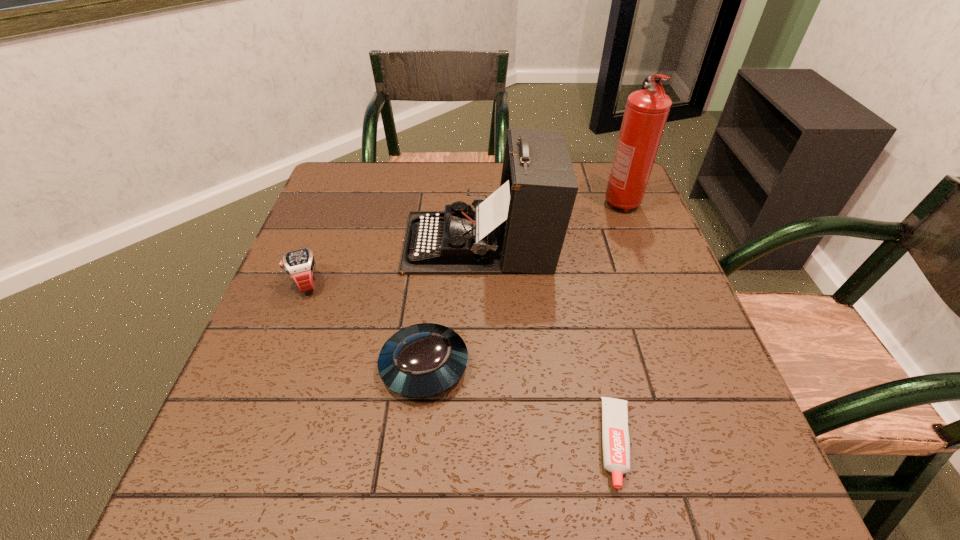
Find the location of a particular element. This screenshot has width=960, height=540. vacant region at the far edge of the desktop is located at coordinates (445, 185).

Where is `free spot at the left edge of the desktop`? This screenshot has height=540, width=960. free spot at the left edge of the desktop is located at coordinates 266,328.

Locate an element on the screen. The image size is (960, 540). vacant space at the right edge of the desktop is located at coordinates (650, 284).

Find the location of `free region at the near left corner of the desktop`. free region at the near left corner of the desktop is located at coordinates (230, 463).

Identify the location of blank space at the far right corner. (602, 177).

Image resolution: width=960 pixels, height=540 pixels. In order to click on free space between the leftmost object and the typewriter in this screenshot , I will do `click(394, 262)`.

Where is `vacant region between the watch and the saucer`? This screenshot has height=540, width=960. vacant region between the watch and the saucer is located at coordinates (366, 324).

At what (x,y) coordinates should I click in order to perform the action: click on free space between the tallest object and the second shortest object. Please return your answer as a coordinate pair (x, y). This screenshot has height=540, width=960. Looking at the image, I should click on (523, 284).

Where is `free point between the saucer and the fourth object from left to right`? free point between the saucer and the fourth object from left to right is located at coordinates (520, 404).

At what (x,y) coordinates should I click in order to perform the action: click on free space between the saucer and the rightmost object. Please return your answer as a coordinate pair (x, y). The image size is (960, 540). Looking at the image, I should click on (523, 284).